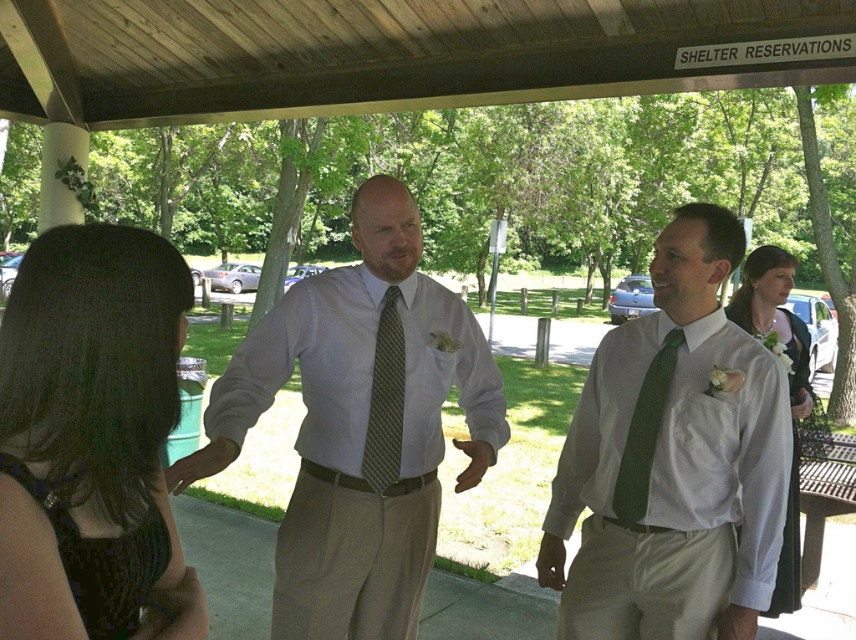
Can you confirm if white dress shirt at center is taller than green dotted tie at center?

Indeed, white dress shirt at center has a greater height compared to green dotted tie at center.

Locate an element on the screen. The height and width of the screenshot is (640, 856). white dress shirt at center is located at coordinates (308, 365).

From the picture: Is white dress shirt at center further to the viewer compared to white satin dress at center?

No, white dress shirt at center is in front of white satin dress at center.

Does white dress shirt at center have a smaller size compared to white satin dress at center?

Yes.

Locate an element on the screen. The height and width of the screenshot is (640, 856). white dress shirt at center is located at coordinates (308, 365).

At what (x,y) coordinates should I click in order to perform the action: click on white dress shirt at center. Please return your answer as a coordinate pair (x, y). Image resolution: width=856 pixels, height=640 pixels. Looking at the image, I should click on (308, 365).

Is black satin dress at left to the left of white dress shirt at center from the viewer's perspective?

Yes, black satin dress at left is to the left of white dress shirt at center.

Does black satin dress at left have a greater width compared to white dress shirt at center?

Incorrect, black satin dress at left's width does not surpass white dress shirt at center's.

Find the location of a particular element. The height and width of the screenshot is (640, 856). black satin dress at left is located at coordinates (96, 372).